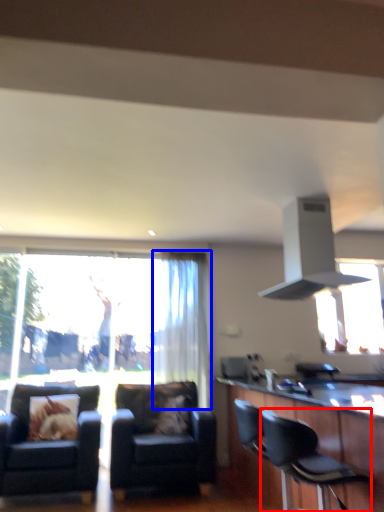
Question: Which point is closer to the camera, chair (highlighted by a red box) or curtain (highlighted by a blue box)?

Choices:
 (A) chair
 (B) curtain

Answer: (A)